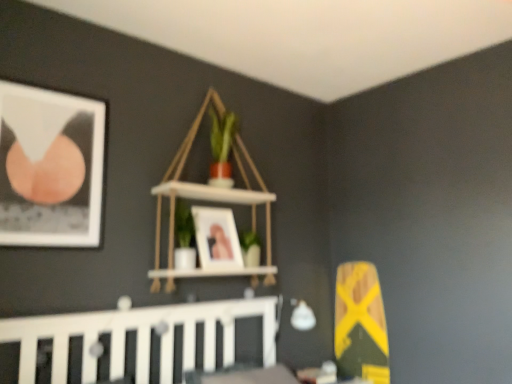
What is the approximate height of white wood shelf at upper center?

white wood shelf at upper center is 3.88 feet tall.

The width and height of the screenshot is (512, 384). What do you see at coordinates (210, 200) in the screenshot?
I see `white wood shelf at upper center` at bounding box center [210, 200].

Identify the location of matte black picture frame at upper left, arranged as the 1th picture frame when viewed from the front. The height and width of the screenshot is (384, 512). (50, 167).

Measure the distance between white wooden crib at lower left and camera.

white wooden crib at lower left is 5.75 feet away from camera.

How much space does matte wooden picture frame at center, acting as the 1th picture frame starting from the right, occupy horizontally?

matte wooden picture frame at center, acting as the 1th picture frame starting from the right, is 6.69 inches wide.

Where is `white wood shelf at upper center`? This screenshot has width=512, height=384. white wood shelf at upper center is located at coordinates 210,200.

In the scene shown: Are matte black picture frame at upper left, the second picture frame viewed from the back, and white wood shelf at upper center beside each other?

No.

Is white wood shelf at upper center at the back of matte black picture frame at upper left, which ranks as the second picture frame in right-to-left order?

That's not correct — matte black picture frame at upper left, which ranks as the second picture frame in right-to-left order, is not looking away from white wood shelf at upper center.

How far apart are matte black picture frame at upper left, the second picture frame viewed from the back, and white wood shelf at upper center?

matte black picture frame at upper left, the second picture frame viewed from the back, is 22.05 inches from white wood shelf at upper center.

Which object is closer to the camera, matte black picture frame at upper left, marked as the 1th picture frame in a left-to-right arrangement, or white wood shelf at upper center?

matte black picture frame at upper left, marked as the 1th picture frame in a left-to-right arrangement.

From a real-world perspective, is matte wooden picture frame at center, acting as the 1th picture frame starting from the right, physically located above or below white wood shelf at upper center?

In terms of real-world spatial position, matte wooden picture frame at center, acting as the 1th picture frame starting from the right, is below white wood shelf at upper center.

Identify the location of picture frame lying below the white wood shelf at upper center (from the image's perspective). This screenshot has width=512, height=384. (217, 238).

Does matte wooden picture frame at center, the 1th picture frame in the back-to-front sequence, have a smaller size compared to white wood shelf at upper center?

Yes, matte wooden picture frame at center, the 1th picture frame in the back-to-front sequence, is smaller than white wood shelf at upper center.

From the image's perspective, which one is positioned higher, matte wooden picture frame at center, which is the second picture frame in front-to-back order, or white wood shelf at upper center?

white wood shelf at upper center appears higher in the image.

Does white wood shelf at upper center turn towards white wooden crib at lower left?

Yes, white wood shelf at upper center is aimed at white wooden crib at lower left.

At what (x,y) coordinates should I click in order to perform the action: click on shelf behind the white wooden crib at lower left. Please return your answer as a coordinate pair (x, y). The width and height of the screenshot is (512, 384). Looking at the image, I should click on (210, 200).

Is white wood shelf at upper center positioned before white wooden crib at lower left?

No.

Is matte wooden picture frame at center, acting as the 1th picture frame starting from the right, oriented away from white wooden crib at lower left?

matte wooden picture frame at center, acting as the 1th picture frame starting from the right, is not turned away from white wooden crib at lower left.

From a real-world perspective, which object rests below the other?

In real-world perspective, white wooden crib at lower left is lower.

Which is behind, point (215, 263) or point (66, 325)?

The point (215, 263) is farther.

In terms of width, does matte wooden picture frame at center, which appears as the second picture frame when viewed from the left, look wider or thinner when compared to white wooden crib at lower left?

In the image, matte wooden picture frame at center, which appears as the second picture frame when viewed from the left, appears to be more narrow than white wooden crib at lower left.

How many degrees apart are the facing directions of white wooden crib at lower left and matte black picture frame at upper left, arranged as the 1th picture frame when viewed from the front?

The angle between the facing direction of white wooden crib at lower left and the facing direction of matte black picture frame at upper left, arranged as the 1th picture frame when viewed from the front, is 1.04 degrees.

From the picture: Measure the distance from white wooden crib at lower left to matte black picture frame at upper left, marked as the 1th picture frame in a left-to-right arrangement.

white wooden crib at lower left is 25.49 inches away from matte black picture frame at upper left, marked as the 1th picture frame in a left-to-right arrangement.

From the picture: From the image's perspective, which one is positioned lower, white wooden crib at lower left or matte black picture frame at upper left, marked as the 1th picture frame in a left-to-right arrangement?

white wooden crib at lower left is shown below in the image.

Considering the relative sizes of white wooden crib at lower left and matte black picture frame at upper left, arranged as the 1th picture frame when viewed from the front, in the image provided, is white wooden crib at lower left bigger than matte black picture frame at upper left, arranged as the 1th picture frame when viewed from the front,?

Yes, white wooden crib at lower left is bigger than matte black picture frame at upper left, arranged as the 1th picture frame when viewed from the front.

Considering the relative sizes of white wood shelf at upper center and matte wooden picture frame at center, acting as the 1th picture frame starting from the right, in the image provided, is white wood shelf at upper center smaller than matte wooden picture frame at center, acting as the 1th picture frame starting from the right,?

Incorrect, white wood shelf at upper center is not smaller in size than matte wooden picture frame at center, acting as the 1th picture frame starting from the right.

From a real-world perspective, is white wood shelf at upper center positioned above or below matte wooden picture frame at center, which is the second picture frame in front-to-back order?

From a real-world perspective, white wood shelf at upper center is physically above matte wooden picture frame at center, which is the second picture frame in front-to-back order.

Who is taller, white wood shelf at upper center or matte wooden picture frame at center, which appears as the second picture frame when viewed from the left?

Standing taller between the two is white wood shelf at upper center.

Would you say white wood shelf at upper center is inside or outside matte wooden picture frame at center, the 1th picture frame in the back-to-front sequence?

white wood shelf at upper center is spatially situated outside matte wooden picture frame at center, the 1th picture frame in the back-to-front sequence.

Considering the points (210, 195) and (60, 144), which point is behind, point (210, 195) or point (60, 144)?

The point (210, 195) is behind.

From the picture: Between white wood shelf at upper center and matte black picture frame at upper left, which ranks as the second picture frame in right-to-left order, which one has more height?

Standing taller between the two is white wood shelf at upper center.

This screenshot has height=384, width=512. Find the location of `shelf behind the matte black picture frame at upper left, arranged as the 1th picture frame when viewed from the front`. shelf behind the matte black picture frame at upper left, arranged as the 1th picture frame when viewed from the front is located at coordinates (210, 200).

At what (x,y) coordinates should I click in order to perform the action: click on picture frame below the white wood shelf at upper center (from the image's perspective). Please return your answer as a coordinate pair (x, y). The width and height of the screenshot is (512, 384). Looking at the image, I should click on (217, 238).

From the image, which object appears to be farther from matte black picture frame at upper left, marked as the 1th picture frame in a left-to-right arrangement, white wooden crib at lower left or matte wooden picture frame at center, which appears as the second picture frame when viewed from the left?

The object further to matte black picture frame at upper left, marked as the 1th picture frame in a left-to-right arrangement, is matte wooden picture frame at center, which appears as the second picture frame when viewed from the left.

Looking at the image, which one is located closer to matte wooden picture frame at center, the 1th picture frame in the back-to-front sequence, white wooden crib at lower left or matte black picture frame at upper left, marked as the 1th picture frame in a left-to-right arrangement?

white wooden crib at lower left is closer to matte wooden picture frame at center, the 1th picture frame in the back-to-front sequence.

Looking at the image, which one is located further to white wooden crib at lower left, matte black picture frame at upper left, the second picture frame viewed from the back, or matte wooden picture frame at center, acting as the 1th picture frame starting from the right?

matte black picture frame at upper left, the second picture frame viewed from the back, lies further to white wooden crib at lower left than the other object.

Which object lies further to the anchor point white wooden crib at lower left, matte black picture frame at upper left, which ranks as the second picture frame in right-to-left order, or white wood shelf at upper center?

Among the two, matte black picture frame at upper left, which ranks as the second picture frame in right-to-left order, is located further to white wooden crib at lower left.

Based on the photo, when comparing their distances from white wood shelf at upper center, does matte black picture frame at upper left, which ranks as the second picture frame in right-to-left order, or matte wooden picture frame at center, which appears as the second picture frame when viewed from the left, seem further?

matte black picture frame at upper left, which ranks as the second picture frame in right-to-left order.

Looking at the image, which one is located closer to matte wooden picture frame at center, which appears as the second picture frame when viewed from the left, matte black picture frame at upper left, marked as the 1th picture frame in a left-to-right arrangement, or white wooden crib at lower left?

white wooden crib at lower left.

From the image, which object appears to be nearer to white wood shelf at upper center, matte black picture frame at upper left, arranged as the 1th picture frame when viewed from the front, or white wooden crib at lower left?

white wooden crib at lower left lies closer to white wood shelf at upper center than the other object.

Looking at the image, which one is located further to matte black picture frame at upper left, the second picture frame viewed from the back, white wood shelf at upper center or matte wooden picture frame at center, the 1th picture frame in the back-to-front sequence?

matte wooden picture frame at center, the 1th picture frame in the back-to-front sequence, lies further to matte black picture frame at upper left, the second picture frame viewed from the back, than the other object.

Locate an element on the screen. The image size is (512, 384). picture frame between matte black picture frame at upper left, the second picture frame viewed from the back, and white wood shelf at upper center from left to right is located at coordinates (217, 238).

This screenshot has width=512, height=384. Identify the location of shelf between white wooden crib at lower left and matte wooden picture frame at center, which appears as the second picture frame when viewed from the left, in the front-back direction. (210, 200).

Find the location of a particular element. The width and height of the screenshot is (512, 384). picture frame between white wooden crib at lower left and white wood shelf at upper center along the z-axis is located at coordinates (50, 167).

The width and height of the screenshot is (512, 384). I want to click on picture frame between white wooden crib at lower left and matte wooden picture frame at center, acting as the 1th picture frame starting from the right, from front to back, so click(x=50, y=167).